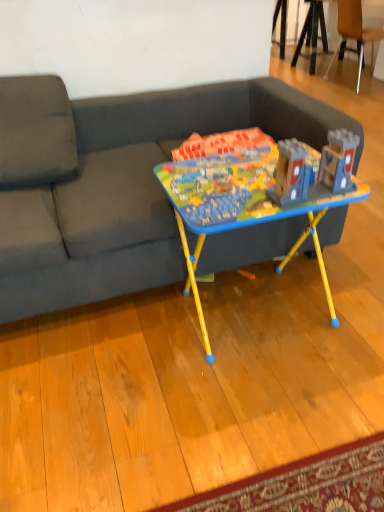
Image resolution: width=384 pixels, height=512 pixels. I want to click on free space on the front side of dark gray fabric couch at center, so click(x=170, y=395).